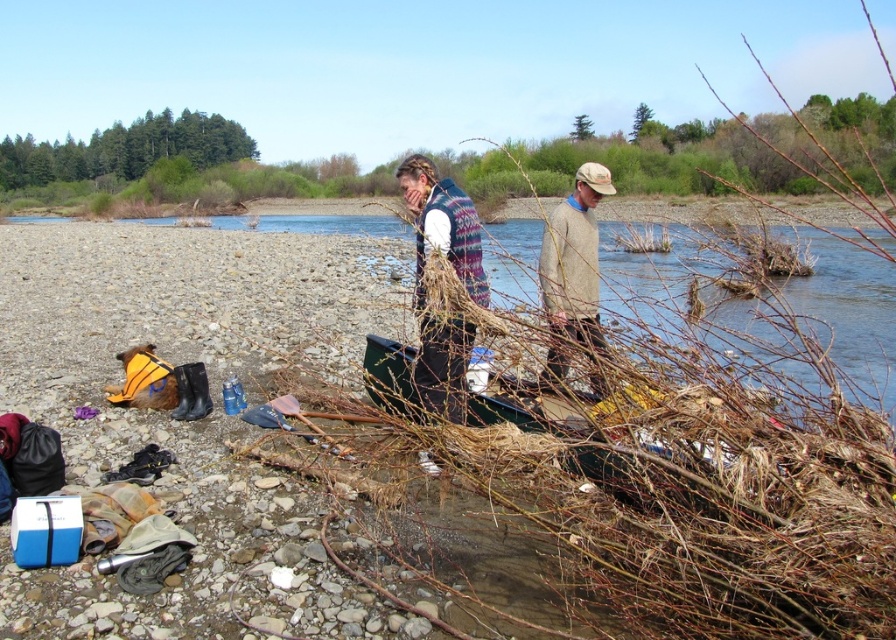
Is knitted sweater at center to the right of knitted wool sweater at center from the viewer's perspective?

Correct, you'll find knitted sweater at center to the right of knitted wool sweater at center.

Which is behind, point (431, 170) or point (416, 304)?

The point (431, 170) is more distant.

Who is more distant from viewer, (442, 356) or (436, 326)?

Point (442, 356)

This screenshot has height=640, width=896. I want to click on knitted sweater at center, so click(442, 227).

Does knitted sweater at center appear over green plastic canoe at center?

Correct, knitted sweater at center is located above green plastic canoe at center.

Which is in front, point (408, 172) or point (546, 419)?

Point (546, 419) is in front.

This screenshot has width=896, height=640. Identify the location of knitted sweater at center. (442, 227).

Is light brown sweater at center bigger than green plastic canoe at center?

Indeed, light brown sweater at center has a larger size compared to green plastic canoe at center.

Image resolution: width=896 pixels, height=640 pixels. I want to click on light brown sweater at center, so click(x=574, y=259).

The width and height of the screenshot is (896, 640). Describe the element at coordinates (574, 259) in the screenshot. I see `light brown sweater at center` at that location.

The image size is (896, 640). What are the coordinates of `light brown sweater at center` in the screenshot? It's located at (574, 259).